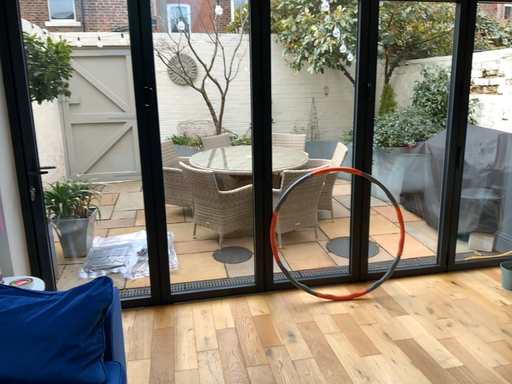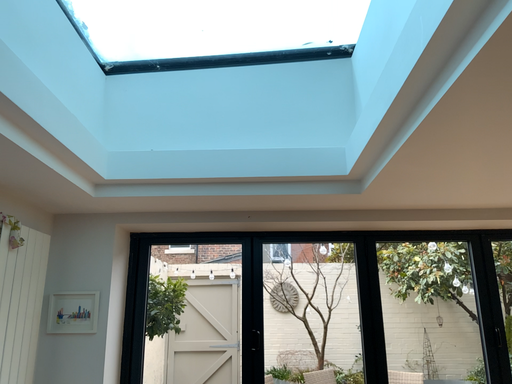
Question: Which way did the camera rotate in the video?

Choices:
 (A) rotated left
 (B) rotated right

Answer: (A)